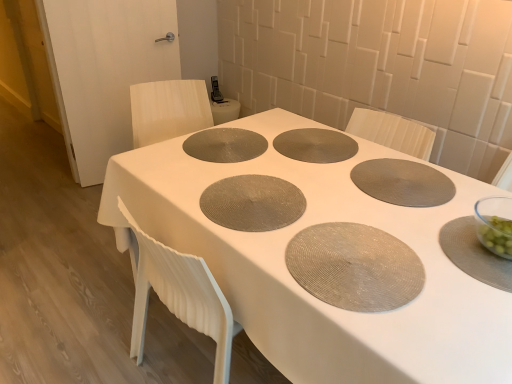
Question: Relative to matte gray placemat at center, positioned as the 3th pizza pan in right-to-left order, is matte gray placemat at center, arranged as the first oval when ordered from the bottom, in front or behind?

Choices:
 (A) behind
 (B) front

Answer: (B)

Question: Is point (370, 292) closer or farther from the camera than point (239, 198)?

Choices:
 (A) farther
 (B) closer

Answer: (B)

Question: Which of these objects is positioned farthest from the matte gray placemat at center, which appears as the first oval when viewed from the front?

Choices:
 (A) matte gray placemat at center, positioned as the 3th pizza pan in right-to-left order
 (B) matte gray placemat at center
 (C) matte gray placemat at center, arranged as the 2th oval when viewed from the front
 (D) matte gray placemat at center right, which ranks as the third pizza pan in left-to-right order
 (E) matte gray placemat at center, positioned as the second pizza pan in right-to-left order

Answer: (C)

Question: Which is farther from the matte gray placemat at center, which is counted as the second oval, starting from the right?

Choices:
 (A) matte gray placemat at center, positioned as the 3th pizza pan in right-to-left order
 (B) matte gray placemat at center right, which ranks as the third pizza pan in left-to-right order
 (C) matte gray placemat at center, which appears as the first oval when viewed from the right
 (D) matte gray placemat at center, positioned as the second pizza pan in right-to-left order
 (E) matte gray placemat at center

Answer: (C)